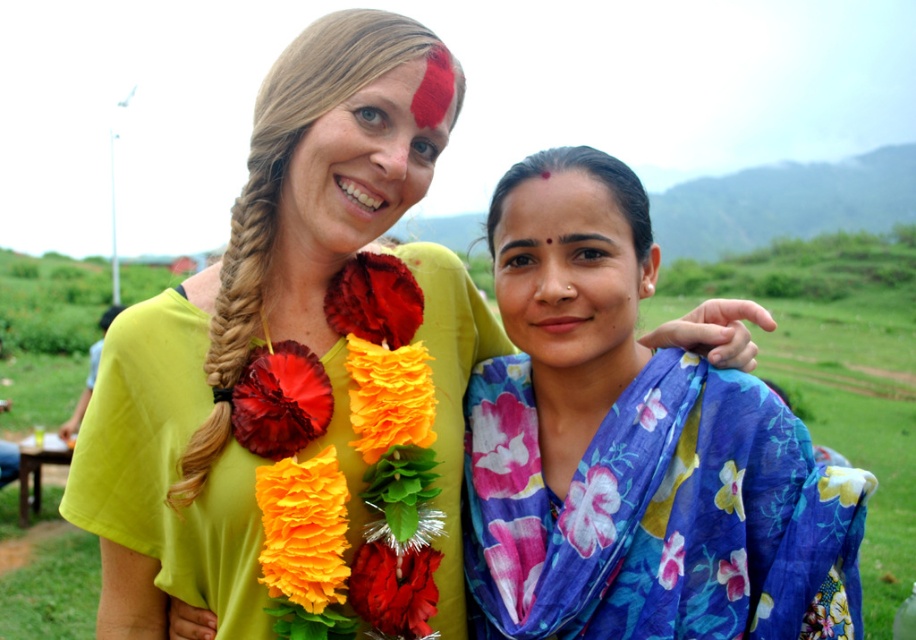
You are a photographer who wants to capture the floral fabric scarf at upper center in the center of your camera frame. Given its current position at coordinates, is it already centered? Please explain using the coordinate system where the bottom left corner is the origin point.

The floral fabric scarf at upper center is located at coordinates point (168,467). In a coordinate system with the bottom left corner as the origin, the center would be at point (458,320). Since the scarf is at 0.730 on the x and 0.184 on the y, it is not centered. It is positioned to the right and lower than the center point.

You are a photographer trying to capture a photo of both individuals in the scene. You notice two points marked in the image. The first point is at coordinates point (852, 608) and the second is at point (306, 221). To ensure both subjects are in focus, you want to know which point is farther from the camera. Which point is farther away?

Point (852, 608) is behind point (306, 221), so it is farther away from the camera.